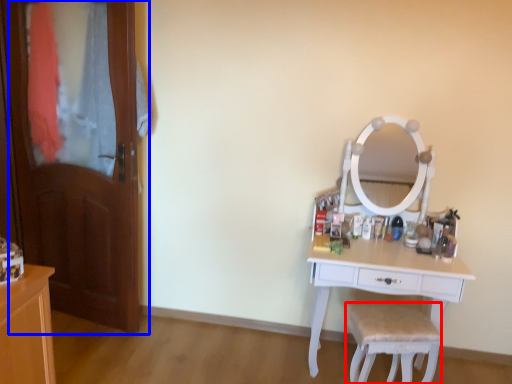
Question: Which of the following is the closest to the observer, chair (highlighted by a red box) or door (highlighted by a blue box)?

Choices:
 (A) chair
 (B) door

Answer: (A)